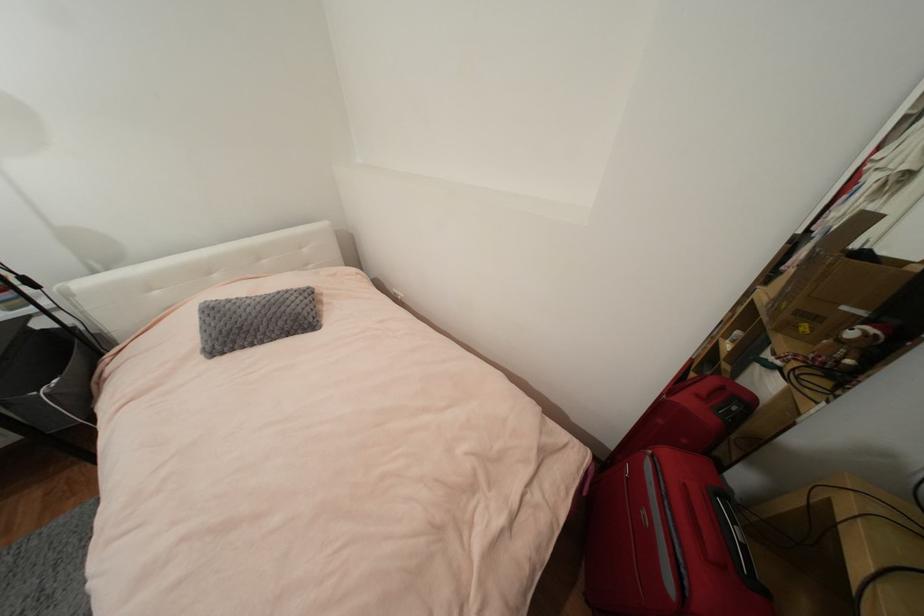
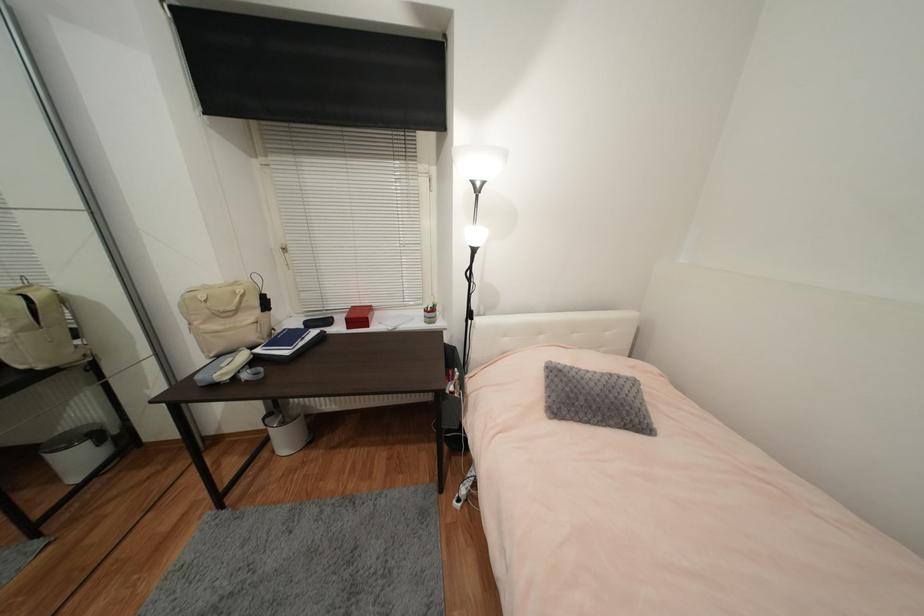
Find the pixel in the second image that matches point (42, 289) in the first image.

(477, 320)